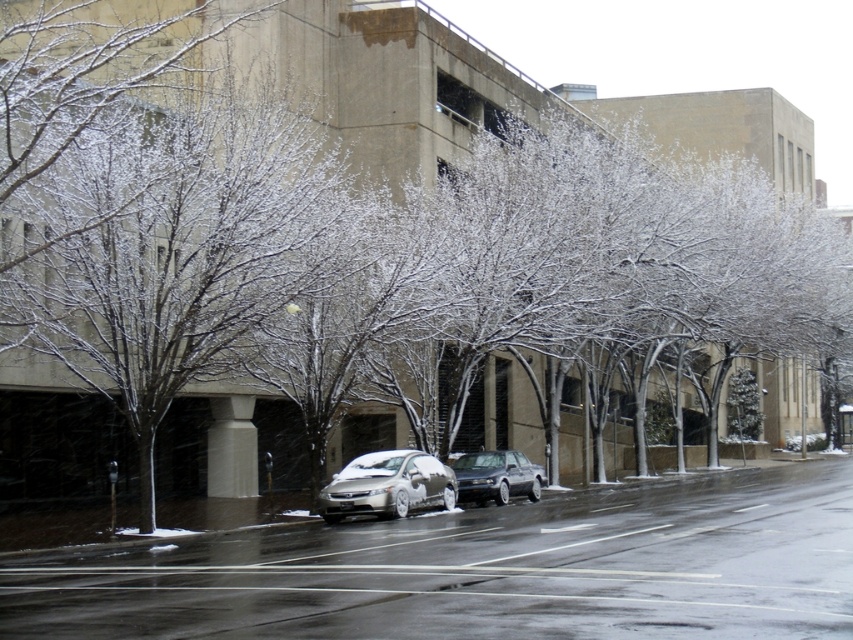
Is satin gold sedan at center shorter than shiny silver sedan at center?

No, satin gold sedan at center is not shorter than shiny silver sedan at center.

You are a GUI agent. You are given a task and a screenshot of the screen. Output one action in this format:
    pyautogui.click(x=<x>, y=<y>)
    Task: Click on the satin gold sedan at center
    
    Given the screenshot: What is the action you would take?
    pyautogui.click(x=387, y=484)

Does glossy asphalt road at lower center appear on the right side of snow-covered branches at left?

Correct, you'll find glossy asphalt road at lower center to the right of snow-covered branches at left.

Does glossy asphalt road at lower center have a greater height compared to snow-covered branches at left?

No.

At what (x,y) coordinates should I click in order to perform the action: click on glossy asphalt road at lower center. Please return your answer as a coordinate pair (x, y). Looking at the image, I should click on (483, 570).

Is glossy asphalt road at lower center positioned behind satin gold sedan at center?

No, it is not.

You are a GUI agent. You are given a task and a screenshot of the screen. Output one action in this format:
    pyautogui.click(x=<x>, y=<y>)
    Task: Click on the glossy asphalt road at lower center
    The height and width of the screenshot is (640, 853).
    Given the screenshot: What is the action you would take?
    pyautogui.click(x=483, y=570)

Who is more distant from viewer, [532,636] or [428,502]?

The point [428,502] is behind.

You are a GUI agent. You are given a task and a screenshot of the screen. Output one action in this format:
    pyautogui.click(x=<x>, y=<y>)
    Task: Click on the glossy asphalt road at lower center
    The width and height of the screenshot is (853, 640).
    Given the screenshot: What is the action you would take?
    pyautogui.click(x=483, y=570)